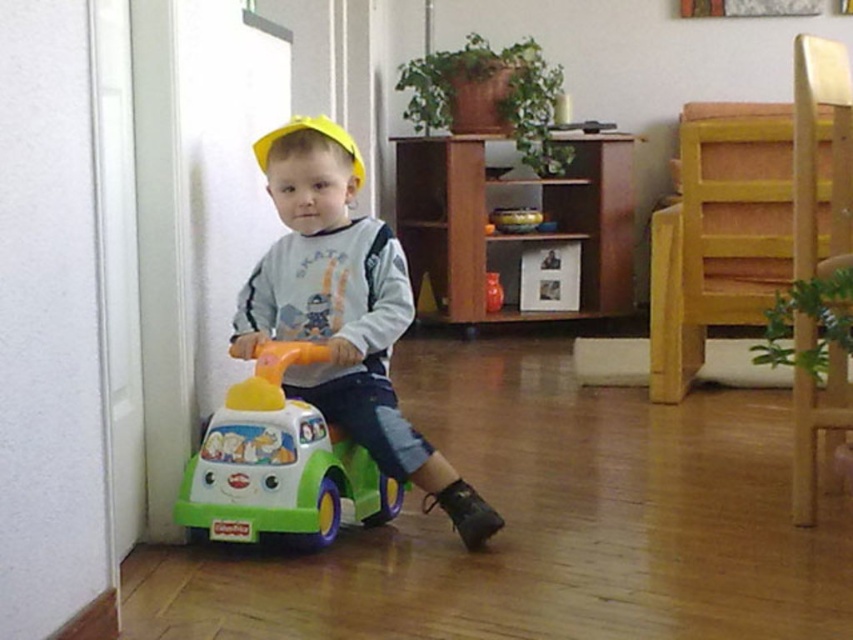
Question: From the image, what is the correct spatial relationship of matte plastic toy car at center in relation to green plastic car at lower left?

Choices:
 (A) left
 (B) right

Answer: (B)

Question: In this image, where is green plastic car at lower left located relative to yellow matte hat at center?

Choices:
 (A) right
 (B) left

Answer: (A)

Question: Based on their relative distances, which object is farther from the green plastic car at lower left?

Choices:
 (A) matte plastic toy car at center
 (B) yellow matte hat at center

Answer: (B)

Question: Which of the following is the closest to the observer?

Choices:
 (A) green plastic car at lower left
 (B) matte plastic toy car at center
 (C) yellow matte hat at center

Answer: (A)

Question: Does green plastic car at lower left have a larger size compared to yellow matte hat at center?

Choices:
 (A) no
 (B) yes

Answer: (A)

Question: Which object is positioned farthest from the green plastic car at lower left?

Choices:
 (A) yellow matte hat at center
 (B) matte plastic toy car at center

Answer: (A)